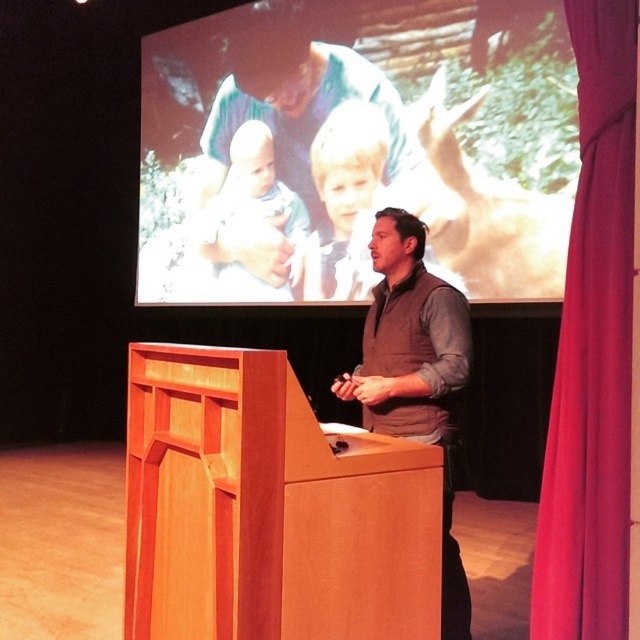
You are an event planner organizing a presentation. You need to decide where to place a 2.5 meter tall banner. The banner must be placed either behind the velvet red curtain at right or in front of the brown vest at center. Based on their heights, which location would allow the banner to be fully visible without being blocked?

The velvet red curtain at right is much taller than the brown vest at center. Therefore, placing the banner behind the velvet red curtain at right would allow it to be fully visible as the curtain can accommodate the banner height without blocking it.

Based on the photo, you are an event planner checking the stage setup. You need to ensure that the matte plastic screen at upper center and the light blonde hair at upper center are positioned so that the screen does not block the speaker. Based on their sizes, which object is wider and would require more space?

The matte plastic screen at upper center is wider than the light blonde hair at upper center, so it requires more space and should be positioned carefully to avoid blocking the speaker.

You are an event organizer and need to adjust the lighting for a presentation. The velvet red curtain at right and the brown vest at center are both in the spotlight. Which object is positioned higher in the scene?

The velvet red curtain at right is above the brown vest at center, so it is positioned higher in the scene.